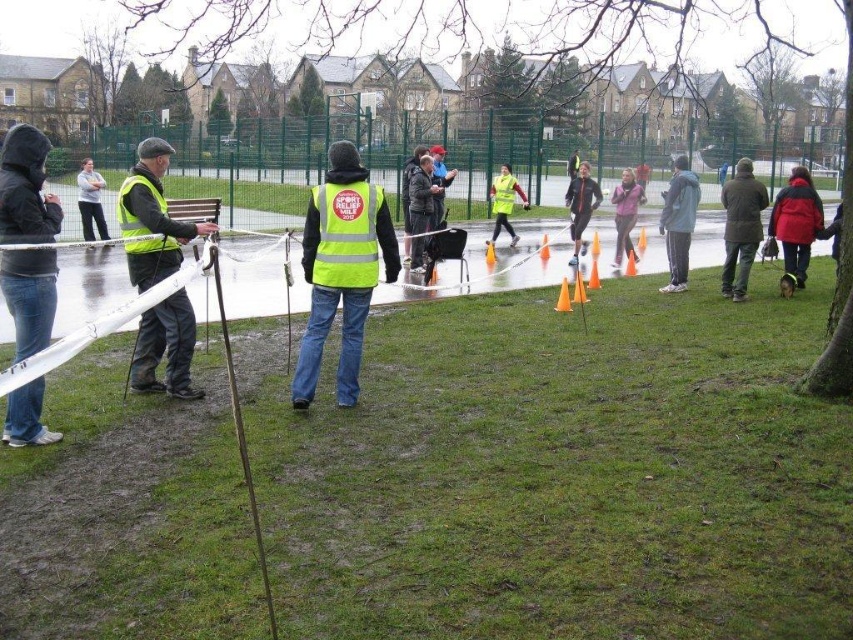
Question: From the image, what is the correct spatial relationship of dark gray hooded jacket at left in relation to high visibility vest at left?

Choices:
 (A) left
 (B) right

Answer: (A)

Question: Which object is the closest to the yellow reflective safety vest at center?

Choices:
 (A) high-visibility fabric safety vest at center
 (B) reflective yellow vest at left
 (C) orange plastic cone at center

Answer: (C)

Question: Which point is closer to the camera taking this photo?

Choices:
 (A) (508, 168)
 (B) (569, 304)
 (C) (572, 252)
 (D) (498, 179)

Answer: (B)

Question: Can you confirm if dark brown leather jacket at right is smaller than yellow reflective safety vest at center?

Choices:
 (A) yes
 (B) no

Answer: (B)

Question: Considering the relative positions of neon yellow reflective vest at center and dark gray hooded jacket at left in the image provided, where is neon yellow reflective vest at center located with respect to dark gray hooded jacket at left?

Choices:
 (A) above
 (B) below

Answer: (A)

Question: Which object appears farthest from the camera in this image?

Choices:
 (A) yellow reflective safety vest at left
 (B) high visibility yellow vest at center

Answer: (B)